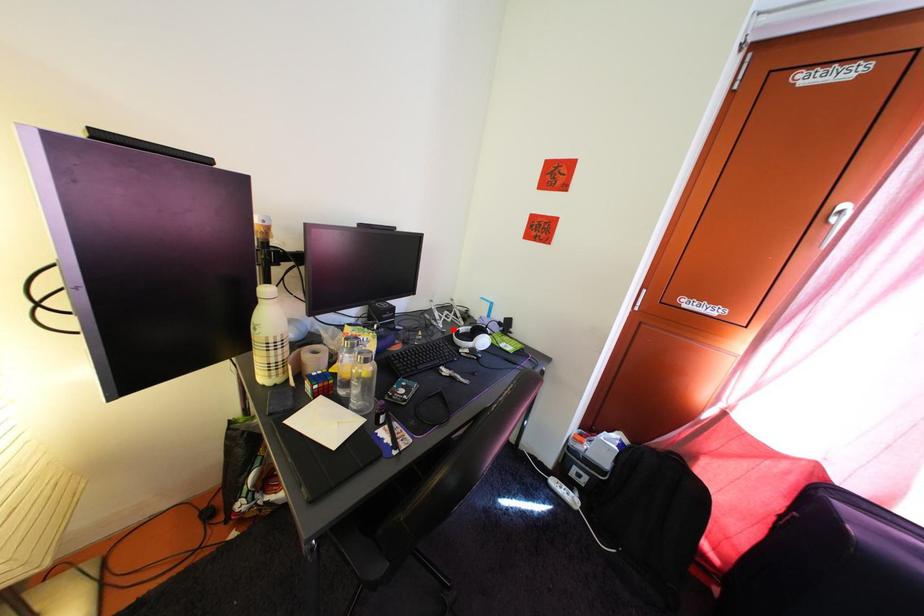
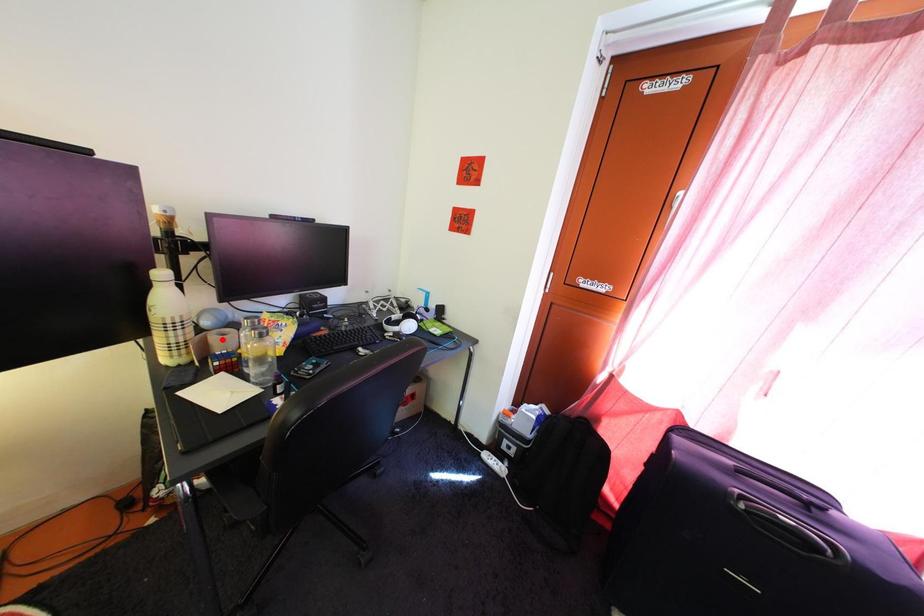
I am providing you with two images of the same scene from different viewpoints. A red point is marked on the first image and another point is marked on the second image. Do the highlighted points in image1 and image2 indicate the same real-world spot?

No